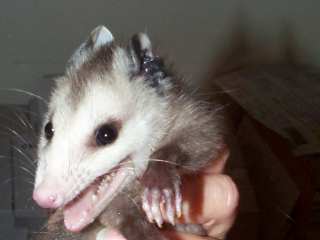
This screenshot has width=320, height=240. I want to click on wall, so click(56, 30).